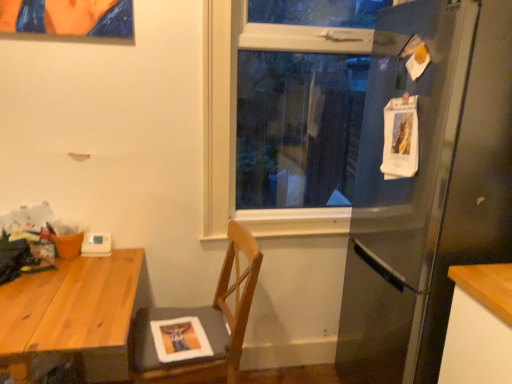
Question: From a real-world perspective, is satin silver refrigerator at right located beneath white plastic thermostat at upper left?

Choices:
 (A) yes
 (B) no

Answer: (B)

Question: From a real-world perspective, does satin silver refrigerator at right stand above white plastic thermostat at upper left?

Choices:
 (A) yes
 (B) no

Answer: (A)

Question: Can you confirm if satin silver refrigerator at right is bigger than white plastic thermostat at upper left?

Choices:
 (A) no
 (B) yes

Answer: (B)

Question: Is satin silver refrigerator at right positioned before white plastic thermostat at upper left?

Choices:
 (A) yes
 (B) no

Answer: (A)

Question: Does satin silver refrigerator at right lie behind white plastic thermostat at upper left?

Choices:
 (A) yes
 (B) no

Answer: (B)

Question: From the image's perspective, does satin silver refrigerator at right appear higher than white plastic thermostat at upper left?

Choices:
 (A) no
 (B) yes

Answer: (B)

Question: Could clear glass window at center be considered to be inside wooden desk at left?

Choices:
 (A) no
 (B) yes

Answer: (A)

Question: Is wooden desk at left to the left of clear glass window at center from the viewer's perspective?

Choices:
 (A) yes
 (B) no

Answer: (A)

Question: Does wooden desk at left have a greater width compared to clear glass window at center?

Choices:
 (A) no
 (B) yes

Answer: (B)

Question: Is wooden desk at left positioned with its back to clear glass window at center?

Choices:
 (A) yes
 (B) no

Answer: (B)

Question: Does wooden desk at left have a smaller size compared to clear glass window at center?

Choices:
 (A) yes
 (B) no

Answer: (B)

Question: Is wooden desk at left beside clear glass window at center?

Choices:
 (A) no
 (B) yes

Answer: (A)

Question: Is the position of white plastic thermostat at upper left more distant than that of wooden desk at left?

Choices:
 (A) yes
 (B) no

Answer: (A)